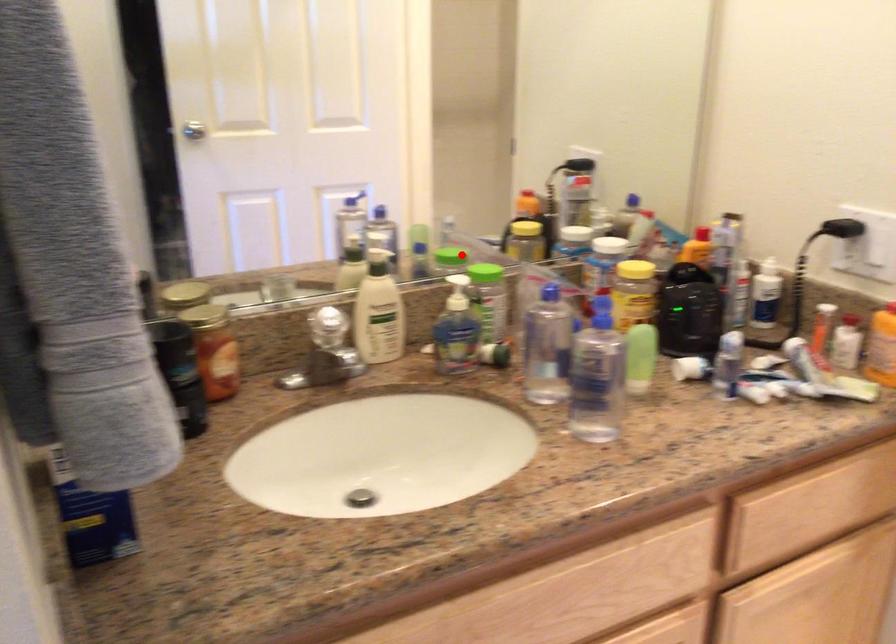
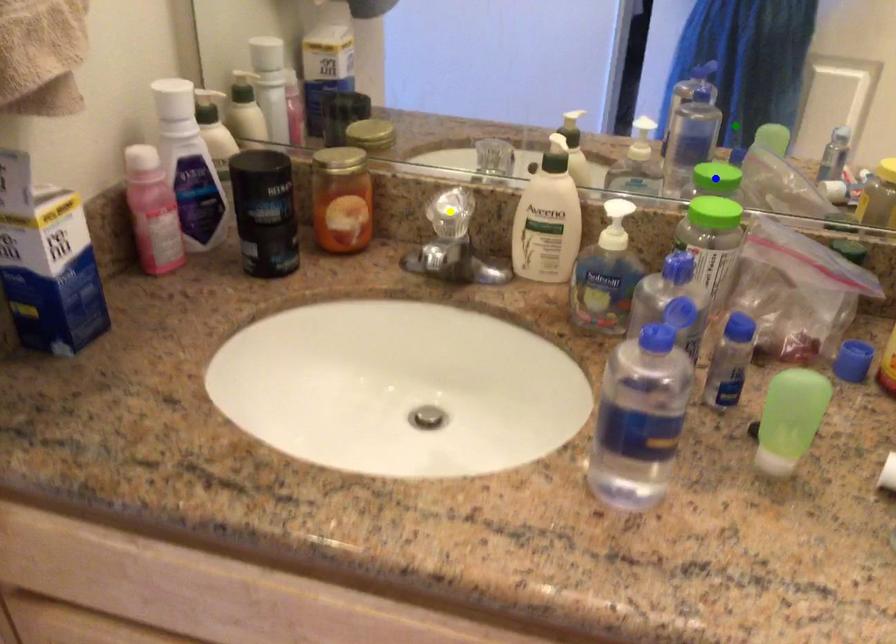
Question: I am providing you with two images of the same scene from different viewpoints. A red point is marked on the first image. You are given multiple points on the second image. Which mark in image 2 goes with the point in image 1?

Choices:
 (A) blue point
 (B) green point
 (C) yellow point

Answer: (A)